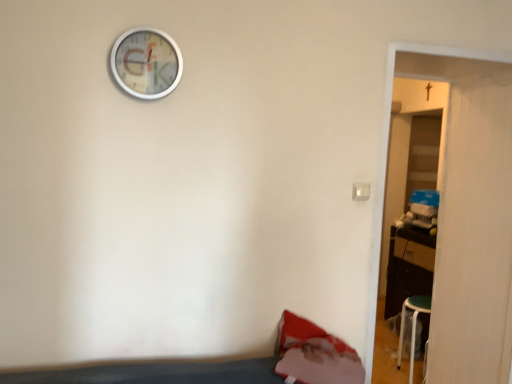
Where is `metallic silver wall clock at upper center`? Image resolution: width=512 pixels, height=384 pixels. metallic silver wall clock at upper center is located at coordinates (146, 63).

The height and width of the screenshot is (384, 512). What do you see at coordinates (146, 63) in the screenshot? I see `metallic silver wall clock at upper center` at bounding box center [146, 63].

At what (x,y) coordinates should I click in order to perform the action: click on wooden door at right. Please return your answer as a coordinate pair (x, y). The image size is (512, 384). Looking at the image, I should click on (470, 195).

This screenshot has width=512, height=384. Describe the element at coordinates (470, 195) in the screenshot. I see `wooden door at right` at that location.

Locate an element on the screen. This screenshot has width=512, height=384. metallic silver wall clock at upper center is located at coordinates (146, 63).

Is wooden door at right to the left of metallic silver wall clock at upper center from the viewer's perspective?

No, wooden door at right is not to the left of metallic silver wall clock at upper center.

Does wooden door at right lie behind metallic silver wall clock at upper center?

Yes, wooden door at right is behind metallic silver wall clock at upper center.

Between point (441, 231) and point (163, 71), which one is positioned in front?

The point (163, 71) is in front.

From the image's perspective, which one is positioned higher, wooden door at right or metallic silver wall clock at upper center?

metallic silver wall clock at upper center, from the image's perspective.

In the scene shown: From a real-world perspective, is wooden door at right located beneath metallic silver wall clock at upper center?

Correct, in the physical world, wooden door at right is lower than metallic silver wall clock at upper center.

Which of these two, wooden door at right or metallic silver wall clock at upper center, is wider?

wooden door at right.

Between wooden door at right and metallic silver wall clock at upper center, which one has less height?

metallic silver wall clock at upper center.

Can you confirm if wooden door at right is smaller than metallic silver wall clock at upper center?

No.

Would you say wooden door at right is outside metallic silver wall clock at upper center?

wooden door at right lies outside metallic silver wall clock at upper center's area.

Is there a large distance between wooden door at right and metallic silver wall clock at upper center?

Absolutely, wooden door at right is distant from metallic silver wall clock at upper center.

Is metallic silver wall clock at upper center at the back of wooden door at right?

wooden door at right does not have its back to metallic silver wall clock at upper center.

What's the angular difference between wooden door at right and metallic silver wall clock at upper center's facing directions?

wooden door at right and metallic silver wall clock at upper center are facing 0.331 degrees away from each other.

Find the location of a particular element. door that appears below the metallic silver wall clock at upper center (from the image's perspective) is located at coordinates (470, 195).

Which object is positioned more to the left, metallic silver wall clock at upper center or wooden door at right?

Positioned to the left is metallic silver wall clock at upper center.

Which is in front, metallic silver wall clock at upper center or wooden door at right?

metallic silver wall clock at upper center.

Is point (137, 37) closer or farther from the camera than point (505, 296)?

Clearly, point (137, 37) is closer to the camera than point (505, 296).

From the image's perspective, which one is positioned higher, metallic silver wall clock at upper center or wooden door at right?

From the image's view, metallic silver wall clock at upper center is above.

From a real-world perspective, is metallic silver wall clock at upper center over wooden door at right?

Yes, from a real-world perspective, metallic silver wall clock at upper center is over wooden door at right

Considering the sizes of metallic silver wall clock at upper center and wooden door at right in the image, is metallic silver wall clock at upper center wider or thinner than wooden door at right?

metallic silver wall clock at upper center is thinner than wooden door at right.

Considering the relative sizes of metallic silver wall clock at upper center and wooden door at right in the image provided, is metallic silver wall clock at upper center shorter than wooden door at right?

Yes, metallic silver wall clock at upper center is shorter than wooden door at right.

Can you confirm if metallic silver wall clock at upper center is smaller than wooden door at right?

Yes, metallic silver wall clock at upper center is smaller than wooden door at right.

Is metallic silver wall clock at upper center positioned beyond the bounds of wooden door at right?

Absolutely, metallic silver wall clock at upper center is external to wooden door at right.

Is metallic silver wall clock at upper center next to wooden door at right and touching it?

No, metallic silver wall clock at upper center is not next to wooden door at right.

Is metallic silver wall clock at upper center looking in the opposite direction of wooden door at right?

That's not correct — metallic silver wall clock at upper center is not looking away from wooden door at right.

How distant is metallic silver wall clock at upper center from wooden door at right?

metallic silver wall clock at upper center is 1.47 meters away from wooden door at right.

Locate an element on the screen. This screenshot has height=384, width=512. wall clock above the wooden door at right (from a real-world perspective) is located at coordinates (146, 63).

Locate an element on the screen. wall clock above the wooden door at right (from the image's perspective) is located at coordinates (146, 63).

This screenshot has width=512, height=384. In order to click on wall clock located above the wooden door at right (from a real-world perspective) in this screenshot , I will do `click(146, 63)`.